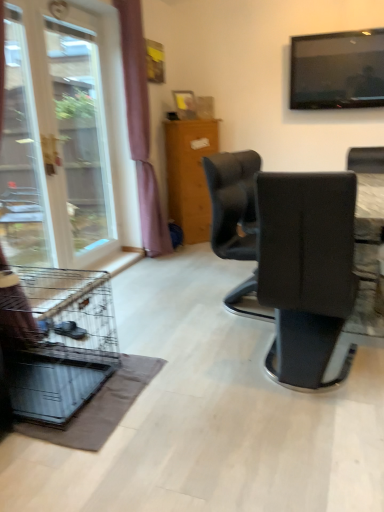
Question: From a real-world perspective, relative to wooden cabinet at center, is transparent glass window at left vertically above or below?

Choices:
 (A) below
 (B) above

Answer: (B)

Question: In terms of size, does transparent glass window at left appear bigger or smaller than wooden cabinet at center?

Choices:
 (A) big
 (B) small

Answer: (B)

Question: Which object is the closest to the black leather chair at center?

Choices:
 (A) metallic wire birdcage at lower left
 (B) flat screen tv at upper right
 (C) transparent glass window at left
 (D) purple fabric curtain at left
 (E) wooden cabinet at center

Answer: (A)

Question: Which object is the closest to the purple fabric curtain at left?

Choices:
 (A) black leather chair at center
 (B) transparent glass screen door at left
 (C) flat screen tv at upper right
 (D) metallic wire birdcage at lower left
 (E) wooden cabinet at center

Answer: (E)